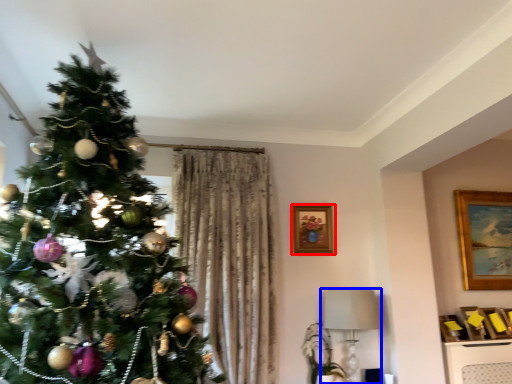
Question: Which object is closer to the camera taking this photo, picture frame (highlighted by a red box) or lamp (highlighted by a blue box)?

Choices:
 (A) picture frame
 (B) lamp

Answer: (B)